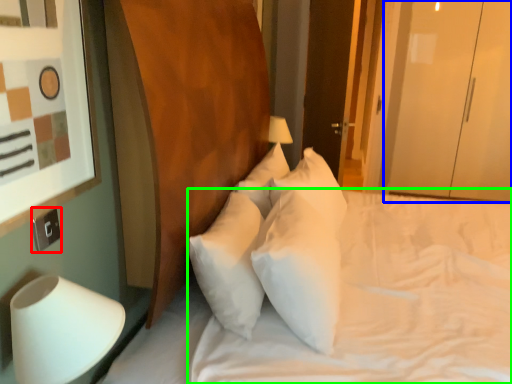
Question: Considering the real-world distances, which object is closest to electric outlet (highlighted by a red box)? glass door (highlighted by a blue box) or mattress (highlighted by a green box).

Choices:
 (A) glass door
 (B) mattress

Answer: (B)